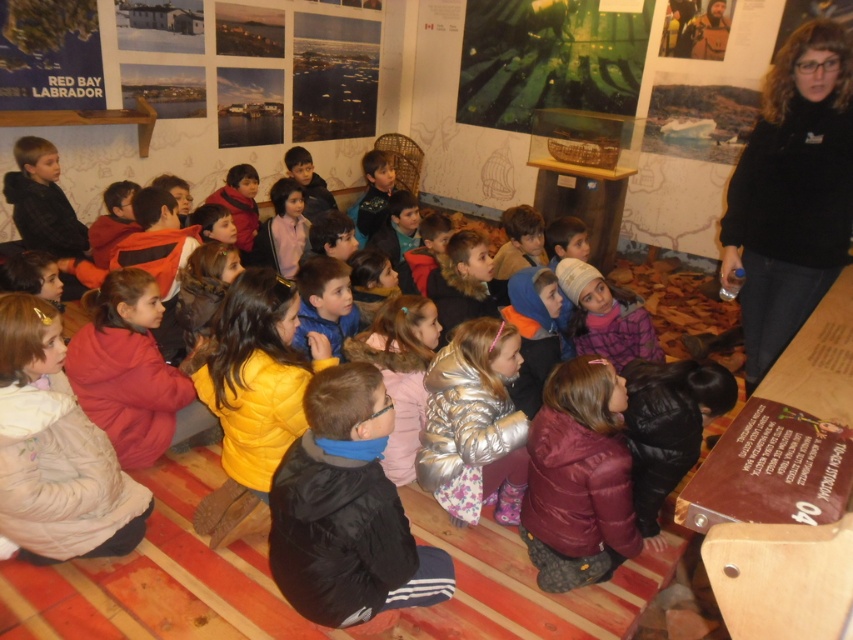
Does black fleece jacket at upper right have a smaller size compared to metallic silver jacket at center?

Actually, black fleece jacket at upper right might be larger than metallic silver jacket at center.

Which is more to the left, black fleece jacket at upper right or metallic silver jacket at center?

Positioned to the left is metallic silver jacket at center.

Does point (848, 92) come farther from viewer compared to point (460, 400)?

That is False.

The height and width of the screenshot is (640, 853). I want to click on black fleece jacket at upper right, so click(791, 193).

Consider the image. Between metallic silver jacket at center and pink fabric jacket at center, which one appears on the left side from the viewer's perspective?

pink fabric jacket at center is more to the left.

Does metallic silver jacket at center appear under pink fabric jacket at center?

Yes, metallic silver jacket at center is below pink fabric jacket at center.

Which is behind, point (495, 499) or point (271, 237)?

The point (271, 237) is behind.

Identify the location of metallic silver jacket at center. The image size is (853, 640). click(474, 422).

Can you confirm if burgundy puffy jacket at lower center is wider than metallic silver jacket at center?

Incorrect, burgundy puffy jacket at lower center's width does not surpass metallic silver jacket at center's.

What do you see at coordinates (578, 477) in the screenshot? I see `burgundy puffy jacket at lower center` at bounding box center [578, 477].

Measure the distance between point (541, 406) and camera.

The distance of point (541, 406) from camera is 2.38 meters.

Locate an element on the screen. burgundy puffy jacket at lower center is located at coordinates (578, 477).